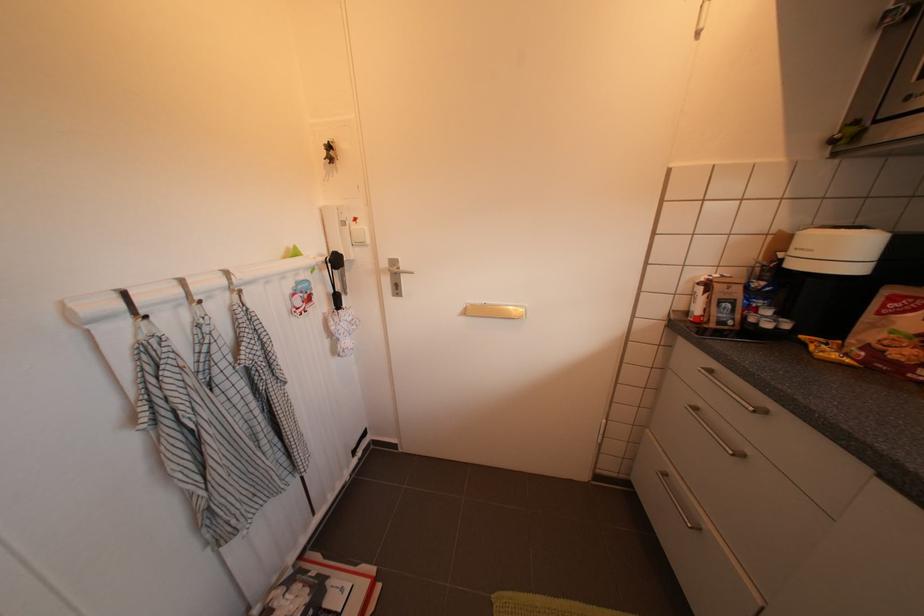
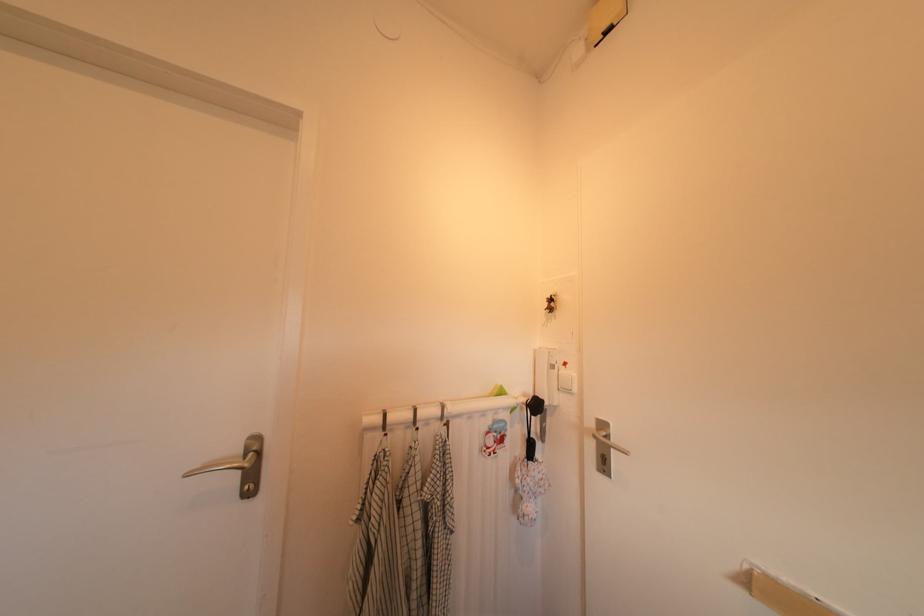
Based on the continuous images, in which direction is the camera rotating?

The rotation direction of the camera is left-up.